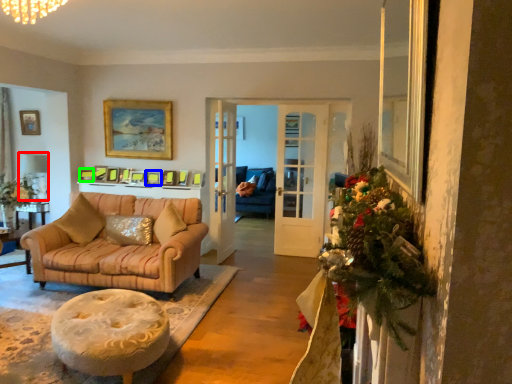
Question: Which object is the farthest from lamp (highlighted by a red box)? Choose among these: picture frame (highlighted by a blue box) or picture frame (highlighted by a green box).

Choices:
 (A) picture frame
 (B) picture frame

Answer: (A)